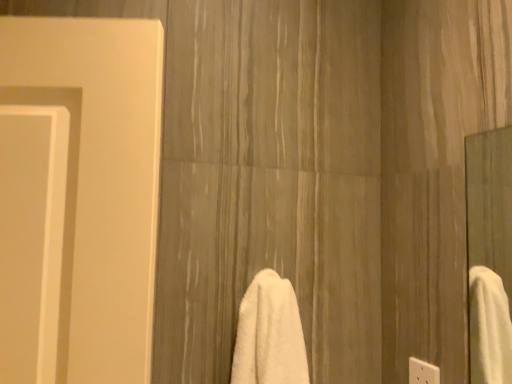
You are a GUI agent. You are given a task and a screenshot of the screen. Output one action in this format:
    pyautogui.click(x=<x>, y=<y>)
    Task: Click on the white fluffy towel at center
    This screenshot has width=512, height=384.
    Given the screenshot: What is the action you would take?
    pyautogui.click(x=269, y=334)

This screenshot has height=384, width=512. Describe the element at coordinates (269, 334) in the screenshot. I see `white fluffy towel at center` at that location.

The image size is (512, 384). What are the coordinates of `white plastic electric outlet at lower right` in the screenshot? It's located at (423, 372).

The image size is (512, 384). Describe the element at coordinates (423, 372) in the screenshot. I see `white plastic electric outlet at lower right` at that location.

Locate an element on the screen. white fluffy towel at center is located at coordinates (269, 334).

Between white plastic electric outlet at lower right and white fluffy towel at center, which one appears on the left side from the viewer's perspective?

white fluffy towel at center is more to the left.

Is white plastic electric outlet at lower right further to the viewer compared to white fluffy towel at center?

Yes.

Is point (421, 382) positioned after point (253, 289)?

Yes.

From the image's perspective, is white plastic electric outlet at lower right located beneath white fluffy towel at center?

Yes, from the image's perspective, white plastic electric outlet at lower right is below white fluffy towel at center.

From a real-world perspective, is white plastic electric outlet at lower right positioned under white fluffy towel at center based on gravity?

Indeed, from a real-world perspective, white plastic electric outlet at lower right is positioned beneath white fluffy towel at center.

Consider the image. Considering the relative sizes of white plastic electric outlet at lower right and white fluffy towel at center in the image provided, is white plastic electric outlet at lower right wider than white fluffy towel at center?

In fact, white plastic electric outlet at lower right might be narrower than white fluffy towel at center.

Can you confirm if white plastic electric outlet at lower right is taller than white fluffy towel at center?

Incorrect, the height of white plastic electric outlet at lower right is not larger of that of white fluffy towel at center.

Considering the sizes of white plastic electric outlet at lower right and white fluffy towel at center in the image, is white plastic electric outlet at lower right bigger or smaller than white fluffy towel at center?

Considering their sizes, white plastic electric outlet at lower right takes up less space than white fluffy towel at center.

Based on the photo, which is correct: white plastic electric outlet at lower right is inside white fluffy towel at center, or outside of it?

white plastic electric outlet at lower right is located beyond the bounds of white fluffy towel at center.

From the picture: Is white plastic electric outlet at lower right directly adjacent to white fluffy towel at center?

No, white plastic electric outlet at lower right is not touching white fluffy towel at center.

Is white plastic electric outlet at lower right facing away from white fluffy towel at center?

white plastic electric outlet at lower right is not turned away from white fluffy towel at center.

You are a GUI agent. You are given a task and a screenshot of the screen. Output one action in this format:
    pyautogui.click(x=<x>, y=<y>)
    Task: Click on the towel in front of the white plastic electric outlet at lower right
    Image resolution: width=512 pixels, height=384 pixels.
    Given the screenshot: What is the action you would take?
    pyautogui.click(x=269, y=334)

Considering the positions of objects white fluffy towel at center and white plastic electric outlet at lower right in the image provided, who is more to the left, white fluffy towel at center or white plastic electric outlet at lower right?

white fluffy towel at center is more to the left.

Is white fluffy towel at center in front of white plastic electric outlet at lower right?

Yes, the depth of white fluffy towel at center is less than that of white plastic electric outlet at lower right.

Does point (264, 301) lie in front of point (411, 360)?

Yes.

From the image's perspective, which one is positioned higher, white fluffy towel at center or white plastic electric outlet at lower right?

From the image's view, white fluffy towel at center is above.

From a real-world perspective, relative to white plastic electric outlet at lower right, is white fluffy towel at center vertically above or below?

From a real-world perspective, white fluffy towel at center is physically above white plastic electric outlet at lower right.

Looking at their sizes, would you say white fluffy towel at center is wider or thinner than white plastic electric outlet at lower right?

white fluffy towel at center is wider than white plastic electric outlet at lower right.

Is white fluffy towel at center taller than white plastic electric outlet at lower right?

Yes.

Can you confirm if white fluffy towel at center is bigger than white plastic electric outlet at lower right?

Yes.

Would you say white fluffy towel at center contains white plastic electric outlet at lower right?

That's incorrect, white plastic electric outlet at lower right is not inside white fluffy towel at center.

Is white fluffy towel at center beside white plastic electric outlet at lower right?

No, white fluffy towel at center is not beside white plastic electric outlet at lower right.

Is white fluffy towel at center facing towards white plastic electric outlet at lower right?

No, white fluffy towel at center is not aimed at white plastic electric outlet at lower right.

What's the angular difference between white fluffy towel at center and white plastic electric outlet at lower right's facing directions?

90.6 degrees.

Where is `electric outlet below the white fluffy towel at center (from the image's perspective)`? This screenshot has height=384, width=512. electric outlet below the white fluffy towel at center (from the image's perspective) is located at coordinates pos(423,372).

You are a GUI agent. You are given a task and a screenshot of the screen. Output one action in this format:
    pyautogui.click(x=<x>, y=<y>)
    Task: Click on the towel that is above the white plastic electric outlet at lower right (from a real-world perspective)
    The image size is (512, 384).
    Given the screenshot: What is the action you would take?
    pyautogui.click(x=269, y=334)

Where is `electric outlet behind the white fluffy towel at center`? This screenshot has width=512, height=384. electric outlet behind the white fluffy towel at center is located at coordinates (423, 372).